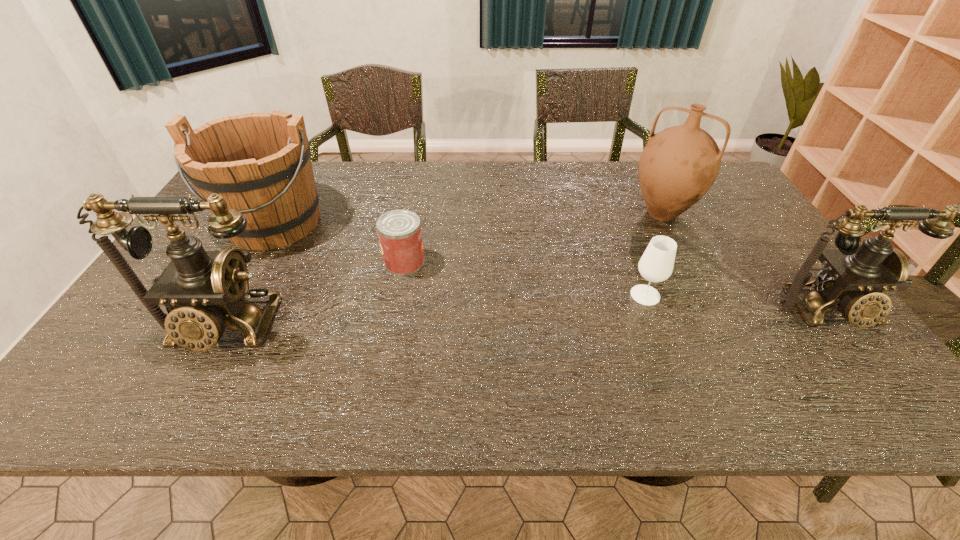
Find the location of `vacant area situated 0.160m on the front of the can`. vacant area situated 0.160m on the front of the can is located at coordinates (394, 322).

Locate an element on the screen. This screenshot has width=960, height=540. free space located 0.080m on the side of the wine bucket with the handle for carrying is located at coordinates (245, 277).

Locate an element on the screen. vacant space located on the back of the glass is located at coordinates (630, 253).

Image resolution: width=960 pixels, height=540 pixels. I want to click on pitcher at the far edge, so click(678, 166).

This screenshot has width=960, height=540. Identify the location of wine bucket at the far edge. (260, 163).

At what (x,y) coordinates should I click in order to perform the action: click on telephone located at the left edge. Please return your answer as a coordinate pair (x, y). The width and height of the screenshot is (960, 540). Looking at the image, I should click on (202, 291).

Find the location of `wine bucket that is at the left edge`. wine bucket that is at the left edge is located at coordinates (260, 163).

You are a GUI agent. You are given a task and a screenshot of the screen. Output one action in this format:
    pyautogui.click(x=<x>, y=<y>)
    Task: Click on the object present at the right edge
    
    Given the screenshot: What is the action you would take?
    pyautogui.click(x=853, y=277)

Where is `object at the far left corner`? object at the far left corner is located at coordinates (260, 163).

You are a GUI agent. You are given a task and a screenshot of the screen. Output one action in this format:
    pyautogui.click(x=<x>, y=<y>)
    Task: Click on the object located in the near left corner section of the desktop
    The image size is (960, 540).
    Given the screenshot: What is the action you would take?
    pyautogui.click(x=202, y=291)